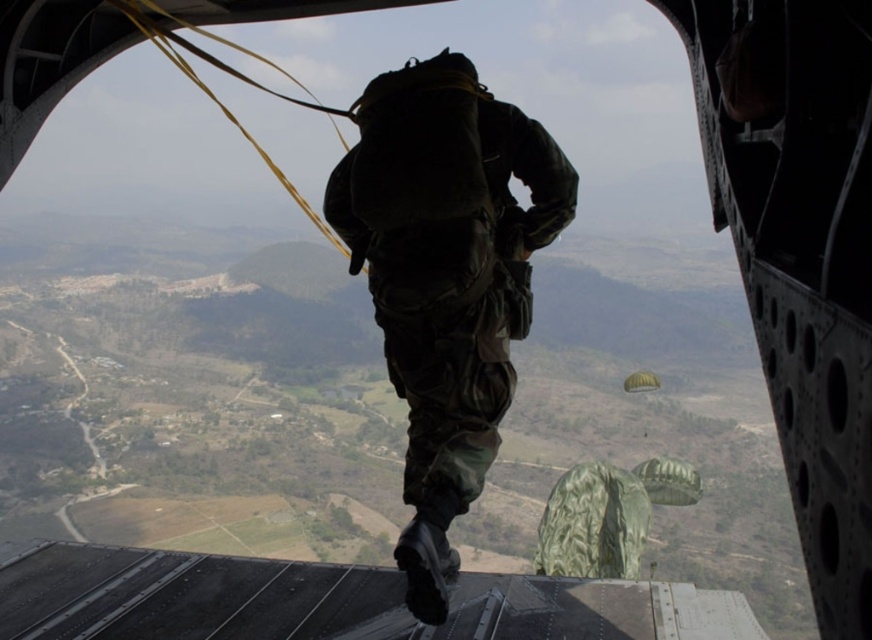
In the scene shown: Is camo fabric uniform at center to the left of green fabric parachute at lower center from the viewer's perspective?

Indeed, camo fabric uniform at center is positioned on the left side of green fabric parachute at lower center.

Which is in front, point (494, 401) or point (641, 387)?

Point (494, 401)

Describe the element at coordinates (446, 278) in the screenshot. I see `camo fabric uniform at center` at that location.

Find the location of `camo fabric uniform at center`. camo fabric uniform at center is located at coordinates (446, 278).